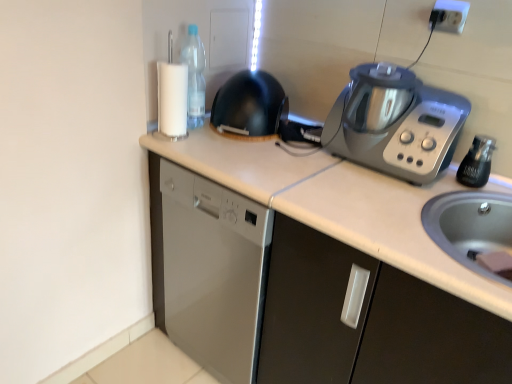
The image size is (512, 384). What are the coordinates of `vacant area in front of black glass bottle at right, positioned as the 1th bottle in right-to-left order` in the screenshot? It's located at (473, 196).